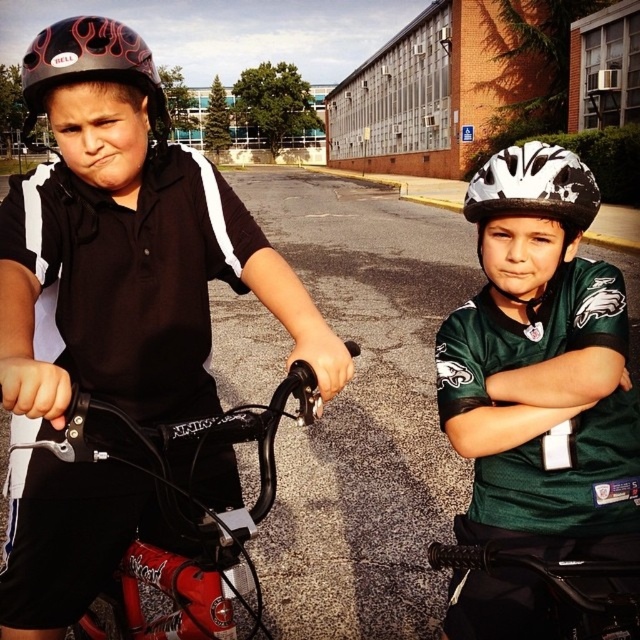
Question: Which of the following is the closest to the observer?

Choices:
 (A) (140, 576)
 (B) (88, 74)

Answer: (B)

Question: Does green matte jersey at center have a smaller size compared to metallic silver bicycle at center?

Choices:
 (A) no
 (B) yes

Answer: (A)

Question: Can you confirm if green matte jersey at center is smaller than black matte helmet at upper left?

Choices:
 (A) yes
 (B) no

Answer: (A)

Question: Which object appears closest to the camera in this image?

Choices:
 (A) metallic silver bicycle at center
 (B) black matte arm at center

Answer: (B)

Question: Which object appears closest to the camera in this image?

Choices:
 (A) green matte jersey at center
 (B) green jersey at right
 (C) black matte handlebar at center
 (D) metallic silver bicycle at center

Answer: (D)

Question: Observing the image, what is the correct spatial positioning of matte black helmet at upper left in reference to black matte handlebar at center?

Choices:
 (A) below
 (B) above

Answer: (A)